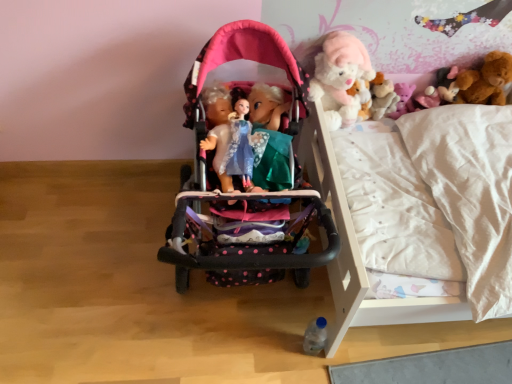
Question: From the image's perspective, is white wooden bunk bed at center positioned above or below pink plush bear at upper right, arranged as the 2th toy when viewed from the right?

Choices:
 (A) below
 (B) above

Answer: (A)

Question: In the image, is white wooden bunk bed at center positioned in front of or behind pink plush bear at upper right, the 2th toy positioned from the bottom?

Choices:
 (A) behind
 (B) front

Answer: (B)

Question: Which is farther from the fluffy white teddy bear at upper right?

Choices:
 (A) clear plastic bottle at lower center, which appears as the first toy when ordered from the bottom
 (B) pink plush bear at upper right, which is counted as the third toy, starting from the top
 (C) matte pink stroller at center
 (D) brown plush bear at upper right, arranged as the fourth toy when ordered from the bottom
 (E) fluffy white teddy bear at upper right, which is the third toy from right to left

Answer: (A)

Question: Estimate the real-world distances between objects in this image. Which object is closer to the clear plastic bottle at lower center, the fourth toy when ordered from top to bottom?

Choices:
 (A) fluffy white teddy bear at upper right, which is counted as the third toy, starting from the bottom
 (B) brown plush bear at upper right, the first toy positioned from the top
 (C) white wooden bunk bed at center
 (D) pink plush bear at upper right, the third toy in the left-to-right sequence
 (E) matte pink stroller at center

Answer: (C)